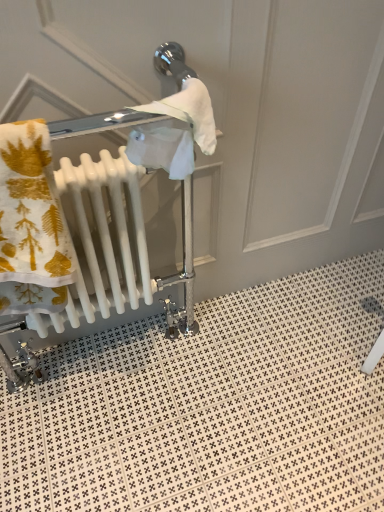
Question: Visually, is white glossy tile at lower center positioned to the left or to the right of white glossy radiator at left?

Choices:
 (A) right
 (B) left

Answer: (A)

Question: Considering the positions of white glossy tile at lower center and white glossy radiator at left in the image, is white glossy tile at lower center bigger or smaller than white glossy radiator at left?

Choices:
 (A) small
 (B) big

Answer: (B)

Question: Would you say white glossy tile at lower center is inside or outside white glossy radiator at left?

Choices:
 (A) outside
 (B) inside

Answer: (A)

Question: Considering the positions of white glossy radiator at left and white glossy tile at lower center in the image, is white glossy radiator at left taller or shorter than white glossy tile at lower center?

Choices:
 (A) tall
 (B) short

Answer: (A)

Question: In the image, is white glossy radiator at left positioned in front of or behind white glossy tile at lower center?

Choices:
 (A) behind
 (B) front

Answer: (B)

Question: Based on their sizes in the image, would you say white glossy radiator at left is bigger or smaller than white glossy tile at lower center?

Choices:
 (A) big
 (B) small

Answer: (B)

Question: From the image's perspective, relative to white glossy tile at lower center, is white glossy radiator at left above or below?

Choices:
 (A) above
 (B) below

Answer: (A)